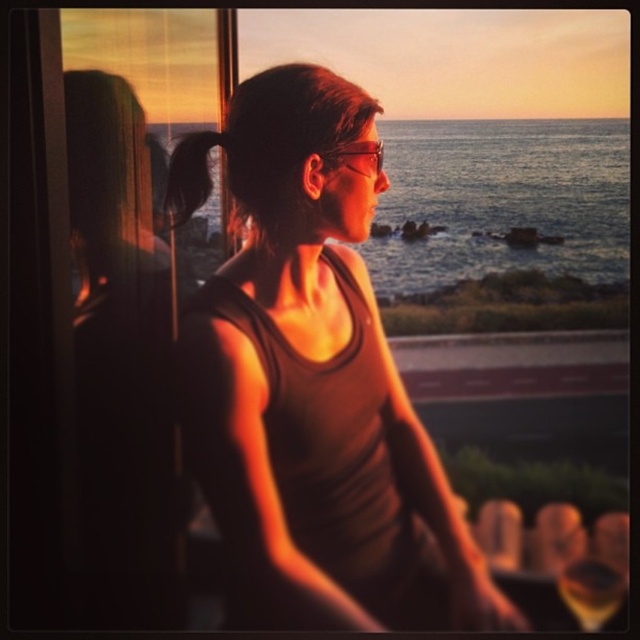
You are a guest in this room and see the translucent glass wine at lower right and the matte black goggles at center. Which object is located to the right of the other?

The translucent glass wine at lower right is positioned on the right side of matte black goggles at center.

From the picture: You are a photographer standing 2 meters away from the camera position. You want to take a photo of the matte brown tank top at center. Can you adjust your position to be closer to the tank top without moving the camera? Explain why or why not.

The matte brown tank top at center is 1.55 meters away from the camera. Since you are currently 2 meters away from the camera position, moving closer to the tank top would require moving towards it, reducing your distance from the camera. However, the tank top is already 1.55 meters from the camera, so if you move closer to it, you can position yourself between the camera and the tank top, thereby being closer to the tank top while still facing it for the photo. However, this might block the camera view. If